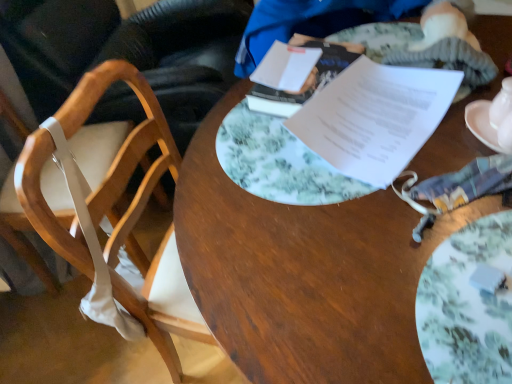
Where is `vacant point to the left of white glossy teapot at upper right`? The height and width of the screenshot is (384, 512). vacant point to the left of white glossy teapot at upper right is located at coordinates (415, 157).